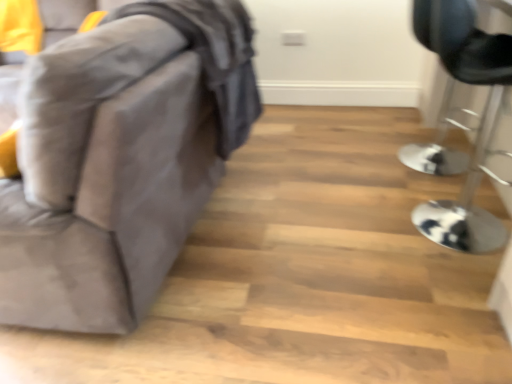
Looking at this image, how much space does velvet gray sofa at left, positioned as the 1th furniture in left-to-right order, occupy horizontally?

2.34 meters.

At what (x,y) coordinates should I click in order to perform the action: click on velvet gray sofa at left, arranged as the 2th furniture when viewed from the right. Please return your answer as a coordinate pair (x, y). The height and width of the screenshot is (384, 512). Looking at the image, I should click on coord(120,159).

This screenshot has height=384, width=512. What do you see at coordinates (120, 159) in the screenshot? I see `velvet gray sofa at left, positioned as the 1th furniture in left-to-right order` at bounding box center [120, 159].

Describe the element at coordinates (479, 123) in the screenshot. The height and width of the screenshot is (384, 512). I see `metallic silver bar stool at right, which is the first furniture in right-to-left order` at that location.

What is the approximate width of metallic silver bar stool at right, which is the first furniture in right-to-left order?

It is 19.22 inches.

Locate an element on the screen. The image size is (512, 384). metallic silver bar stool at right, which is counted as the second furniture, starting from the left is located at coordinates (479, 123).

Locate an element on the screen. This screenshot has height=384, width=512. velvet gray sofa at left, positioned as the 1th furniture in left-to-right order is located at coordinates (120, 159).

Which is more to the right, velvet gray sofa at left, positioned as the 1th furniture in left-to-right order, or metallic silver bar stool at right, which is counted as the second furniture, starting from the left?

metallic silver bar stool at right, which is counted as the second furniture, starting from the left, is more to the right.

Considering the positions of objects velvet gray sofa at left, positioned as the 1th furniture in left-to-right order, and metallic silver bar stool at right, which is counted as the second furniture, starting from the left, in the image provided, who is behind, velvet gray sofa at left, positioned as the 1th furniture in left-to-right order, or metallic silver bar stool at right, which is counted as the second furniture, starting from the left,?

metallic silver bar stool at right, which is counted as the second furniture, starting from the left, is more distant.

Considering the positions of points (226, 33) and (434, 211), is point (226, 33) farther from camera compared to point (434, 211)?

No.

From the image's perspective, is velvet gray sofa at left, arranged as the 2th furniture when viewed from the right, on metallic silver bar stool at right, which is counted as the second furniture, starting from the left?

Yes, from the image's perspective, velvet gray sofa at left, arranged as the 2th furniture when viewed from the right, is on top of metallic silver bar stool at right, which is counted as the second furniture, starting from the left.

From a real-world perspective, who is located lower, velvet gray sofa at left, positioned as the 1th furniture in left-to-right order, or metallic silver bar stool at right, which is counted as the second furniture, starting from the left?

metallic silver bar stool at right, which is counted as the second furniture, starting from the left, is physically lower.

Considering the relative sizes of velvet gray sofa at left, arranged as the 2th furniture when viewed from the right, and metallic silver bar stool at right, which is the first furniture in right-to-left order, in the image provided, is velvet gray sofa at left, arranged as the 2th furniture when viewed from the right, wider than metallic silver bar stool at right, which is the first furniture in right-to-left order,?

Yes, velvet gray sofa at left, arranged as the 2th furniture when viewed from the right, is wider than metallic silver bar stool at right, which is the first furniture in right-to-left order.

Based on the photo, who is shorter, velvet gray sofa at left, arranged as the 2th furniture when viewed from the right, or metallic silver bar stool at right, which is counted as the second furniture, starting from the left?

metallic silver bar stool at right, which is counted as the second furniture, starting from the left, is shorter.

Is velvet gray sofa at left, arranged as the 2th furniture when viewed from the right, smaller than metallic silver bar stool at right, which is the first furniture in right-to-left order?

Incorrect, velvet gray sofa at left, arranged as the 2th furniture when viewed from the right, is not smaller in size than metallic silver bar stool at right, which is the first furniture in right-to-left order.

Is velvet gray sofa at left, arranged as the 2th furniture when viewed from the right, outside of metallic silver bar stool at right, which is the first furniture in right-to-left order?

velvet gray sofa at left, arranged as the 2th furniture when viewed from the right, is positioned outside metallic silver bar stool at right, which is the first furniture in right-to-left order.

Are velvet gray sofa at left, positioned as the 1th furniture in left-to-right order, and metallic silver bar stool at right, which is the first furniture in right-to-left order, located far from each other?

Yes, velvet gray sofa at left, positioned as the 1th furniture in left-to-right order, and metallic silver bar stool at right, which is the first furniture in right-to-left order, are located far from each other.

Is metallic silver bar stool at right, which is the first furniture in right-to-left order, at the back of velvet gray sofa at left, arranged as the 2th furniture when viewed from the right?

No, velvet gray sofa at left, arranged as the 2th furniture when viewed from the right, is not facing away from metallic silver bar stool at right, which is the first furniture in right-to-left order.

Measure the distance between velvet gray sofa at left, positioned as the 1th furniture in left-to-right order, and metallic silver bar stool at right, which is the first furniture in right-to-left order.

velvet gray sofa at left, positioned as the 1th furniture in left-to-right order, is 4.02 feet from metallic silver bar stool at right, which is the first furniture in right-to-left order.

This screenshot has height=384, width=512. I want to click on furniture on the left of metallic silver bar stool at right, which is the first furniture in right-to-left order, so click(120, 159).

Does metallic silver bar stool at right, which is the first furniture in right-to-left order, appear on the right side of velvet gray sofa at left, arranged as the 2th furniture when viewed from the right?

Indeed, metallic silver bar stool at right, which is the first furniture in right-to-left order, is positioned on the right side of velvet gray sofa at left, arranged as the 2th furniture when viewed from the right.

Is metallic silver bar stool at right, which is the first furniture in right-to-left order, positioned before velvet gray sofa at left, arranged as the 2th furniture when viewed from the right?

No, it is behind velvet gray sofa at left, arranged as the 2th furniture when viewed from the right.

Considering the positions of point (489, 41) and point (187, 155), is point (489, 41) closer or farther from the camera than point (187, 155)?

Clearly, point (489, 41) is closer to the camera than point (187, 155).

From the image's perspective, between metallic silver bar stool at right, which is counted as the second furniture, starting from the left, and velvet gray sofa at left, positioned as the 1th furniture in left-to-right order, which one is located above?

velvet gray sofa at left, positioned as the 1th furniture in left-to-right order, from the image's perspective.

From a real-world perspective, is metallic silver bar stool at right, which is counted as the second furniture, starting from the left, above or below velvet gray sofa at left, positioned as the 1th furniture in left-to-right order?

In terms of real-world spatial position, metallic silver bar stool at right, which is counted as the second furniture, starting from the left, is below velvet gray sofa at left, positioned as the 1th furniture in left-to-right order.

In terms of width, does metallic silver bar stool at right, which is the first furniture in right-to-left order, look wider or thinner when compared to velvet gray sofa at left, arranged as the 2th furniture when viewed from the right?

Clearly, metallic silver bar stool at right, which is the first furniture in right-to-left order, has less width compared to velvet gray sofa at left, arranged as the 2th furniture when viewed from the right.

From the picture: Can you confirm if metallic silver bar stool at right, which is counted as the second furniture, starting from the left, is shorter than velvet gray sofa at left, positioned as the 1th furniture in left-to-right order?

Correct, metallic silver bar stool at right, which is counted as the second furniture, starting from the left, is not as tall as velvet gray sofa at left, positioned as the 1th furniture in left-to-right order.

Which of these two, metallic silver bar stool at right, which is the first furniture in right-to-left order, or velvet gray sofa at left, positioned as the 1th furniture in left-to-right order, is bigger?

With larger size is velvet gray sofa at left, positioned as the 1th furniture in left-to-right order.

Is metallic silver bar stool at right, which is counted as the second furniture, starting from the left, outside of velvet gray sofa at left, arranged as the 2th furniture when viewed from the right?

Yes.

Is metallic silver bar stool at right, which is the first furniture in right-to-left order, directly adjacent to velvet gray sofa at left, positioned as the 1th furniture in left-to-right order?

There is a gap between metallic silver bar stool at right, which is the first furniture in right-to-left order, and velvet gray sofa at left, positioned as the 1th furniture in left-to-right order.

Is metallic silver bar stool at right, which is the first furniture in right-to-left order, looking in the opposite direction of velvet gray sofa at left, arranged as the 2th furniture when viewed from the right?

Yes, metallic silver bar stool at right, which is the first furniture in right-to-left order, is positioned with its back facing velvet gray sofa at left, arranged as the 2th furniture when viewed from the right.

How many degrees apart are the facing directions of metallic silver bar stool at right, which is the first furniture in right-to-left order, and velvet gray sofa at left, positioned as the 1th furniture in left-to-right order?

There is a 90-degree angle between the facing directions of metallic silver bar stool at right, which is the first furniture in right-to-left order, and velvet gray sofa at left, positioned as the 1th furniture in left-to-right order.

Locate an element on the screen. The width and height of the screenshot is (512, 384). furniture located on the right of velvet gray sofa at left, positioned as the 1th furniture in left-to-right order is located at coordinates (479, 123).

Locate an element on the screen. This screenshot has height=384, width=512. furniture on the left of the metallic silver bar stool at right, which is counted as the second furniture, starting from the left is located at coordinates (120, 159).

Locate an element on the screen. This screenshot has width=512, height=384. furniture behind the velvet gray sofa at left, arranged as the 2th furniture when viewed from the right is located at coordinates (479, 123).